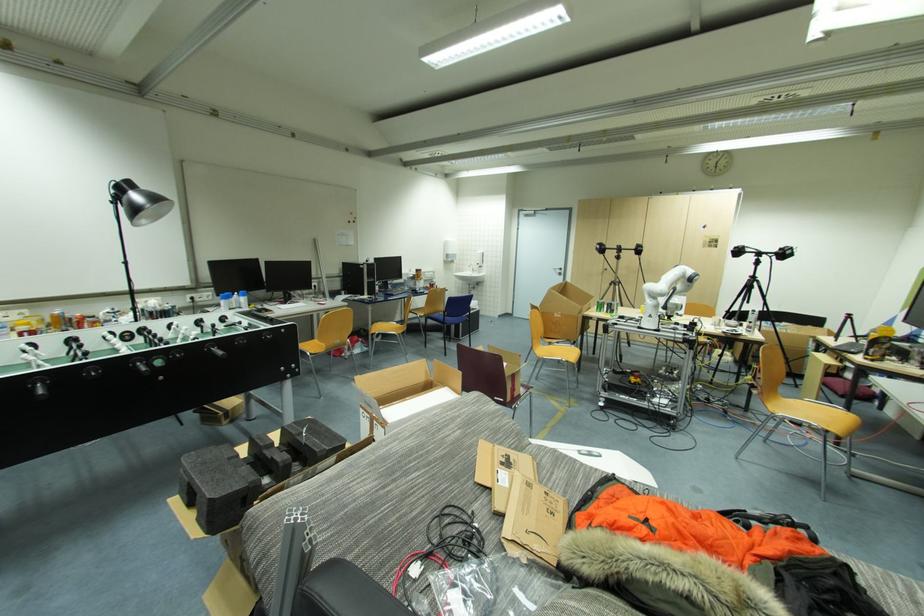
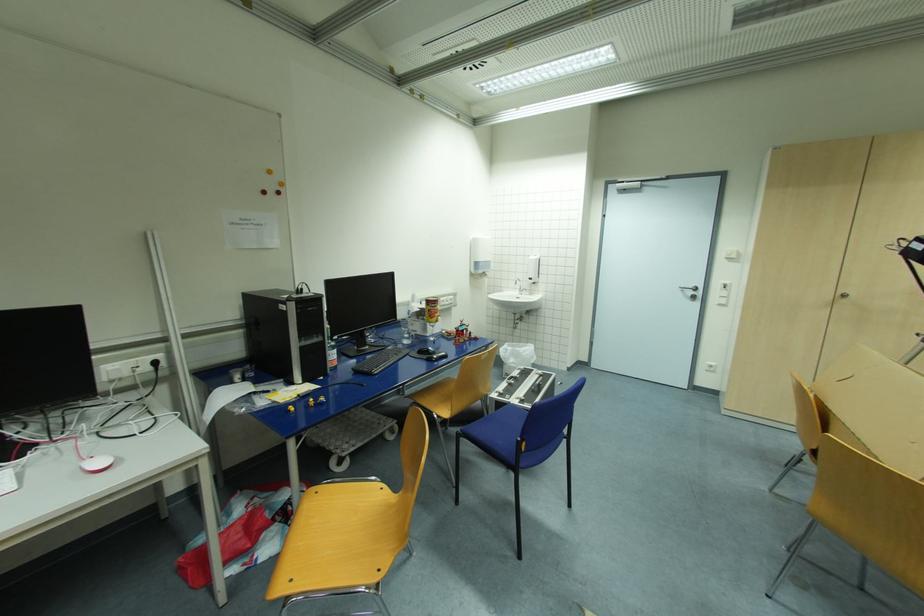
Find the pixel in the second image that matches (x=609, y=270) in the first image.

(847, 296)